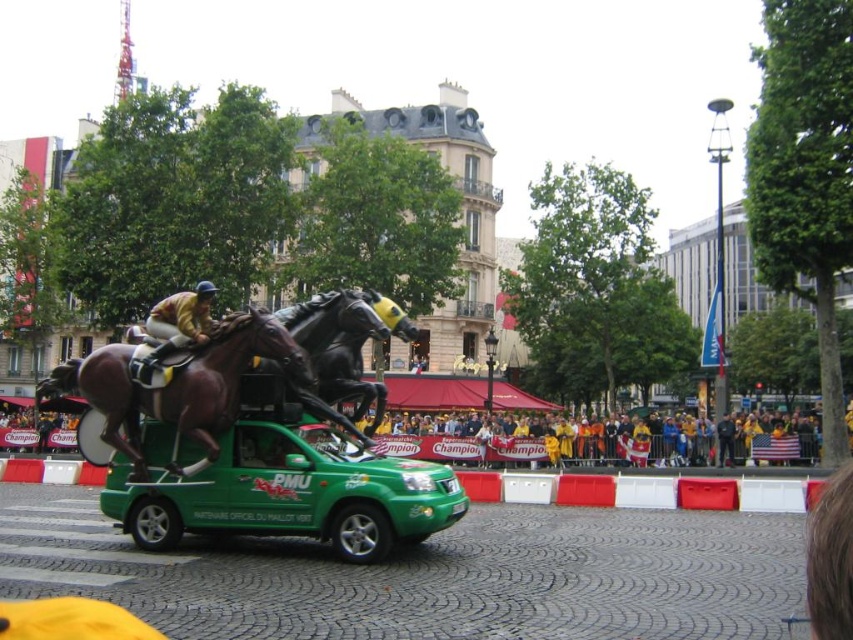
Which is more to the right, green plastic toy car at center or yellow fabric at lower center?

yellow fabric at lower center is more to the right.

Identify the location of green plastic toy car at center. (283, 490).

Between yellow fabric at lower center and shiny black horse at center, which one has more height?

shiny black horse at center is taller.

Does yellow fabric at lower center appear on the right side of shiny black horse at center?

Indeed, yellow fabric at lower center is positioned on the right side of shiny black horse at center.

This screenshot has width=853, height=640. Describe the element at coordinates (550, 445) in the screenshot. I see `yellow fabric at lower center` at that location.

The image size is (853, 640). What are the coordinates of `yellow fabric at lower center` in the screenshot? It's located at (550, 445).

The image size is (853, 640). I want to click on shiny brown horse at center, so click(x=178, y=384).

Can you confirm if shiny brown horse at center is shorter than shiny black horse at center?

A: In fact, shiny brown horse at center may be taller than shiny black horse at center.

Measure the distance between point (213, 388) and camera.

The distance of point (213, 388) from camera is 47.31 meters.

Locate an element on the screen. The height and width of the screenshot is (640, 853). shiny brown horse at center is located at coordinates (178, 384).